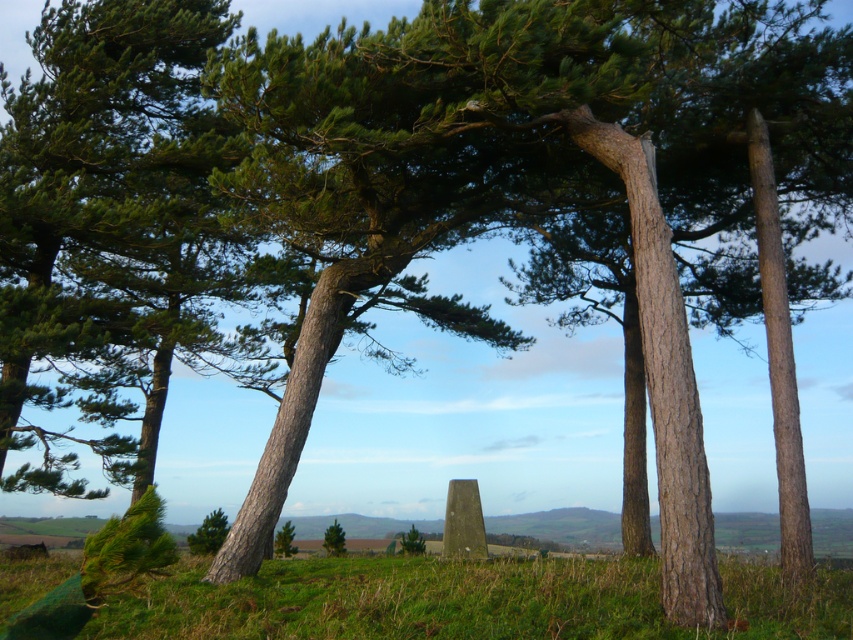
You are standing in the middle of the scene and want to place a small garden bench. The bench requires a flat area larger than the green rough bark tree at lower center. Is there enough space on the green grassy at lower left to place it?

The green grassy at lower left is bigger than the green rough bark tree at lower center, so yes, there is enough space to place the bench there since the grassy area is larger than the tree.

You are planning to place a small garden bench between the green rough bark tree at lower center and the green matte tree at lower left. Which tree should the bench be closer to if you want it to look proportionally balanced with both trees?

The bench should be placed closer to the green matte tree at lower left because the green rough bark tree at lower center is larger in size, creating a balance in their visual weight.